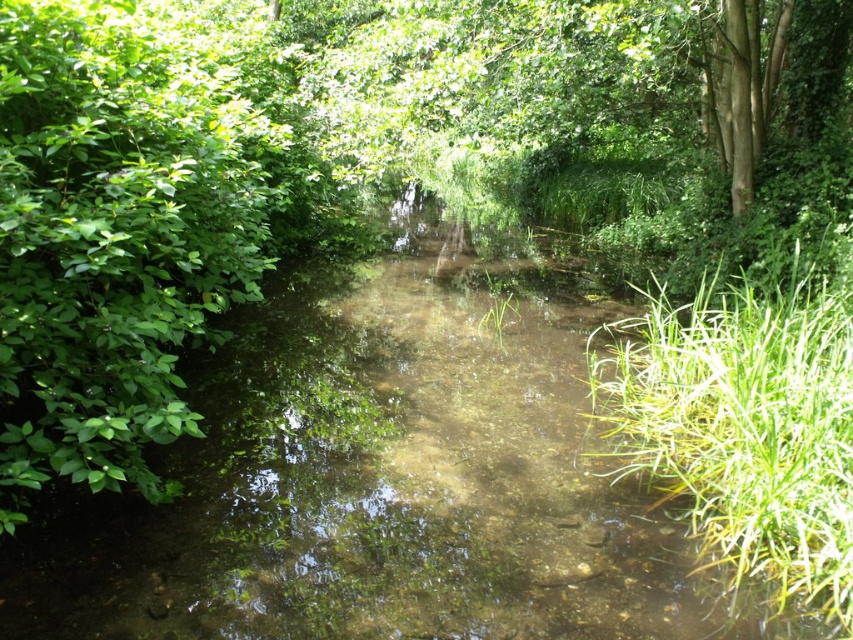
What are the coordinates of the clear water stream at center in the image?

The clear water stream at center is located at coordinates point (386, 472).

You are planning to cross the clear water stream at center and need to step on the green grassy at right for stability. Based on their heights, which one is lower to the ground?

The clear water stream at center is shorter than green grassy at right, so the clear water stream at center is lower to the ground.

You are a hiker trying to cross the stream. You see the clear water stream at center and the green grassy at right. Which direction should you walk to reach the grassy area from the stream?

You should walk to the right from the clear water stream at center to reach the green grassy at right since the stream is to the left of the grassy area.